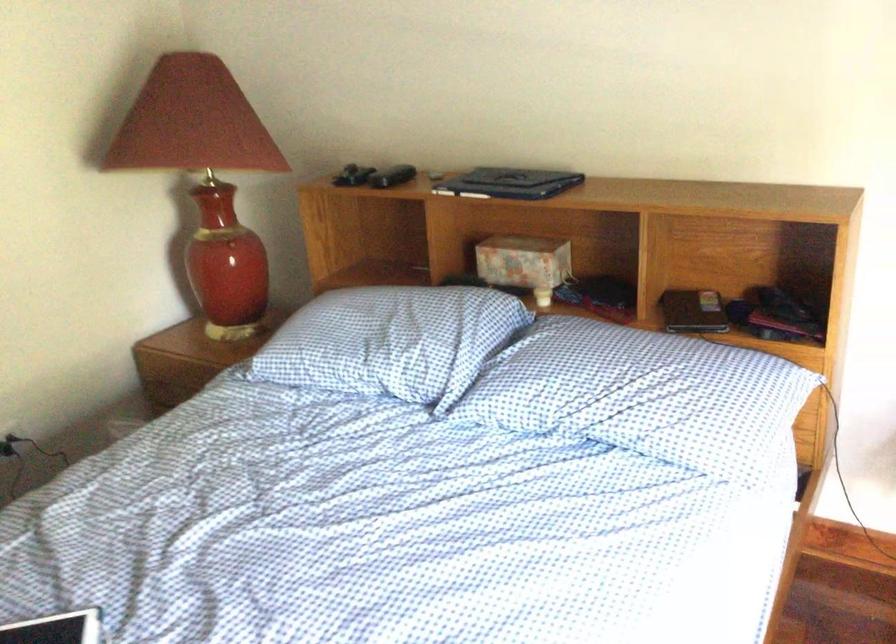
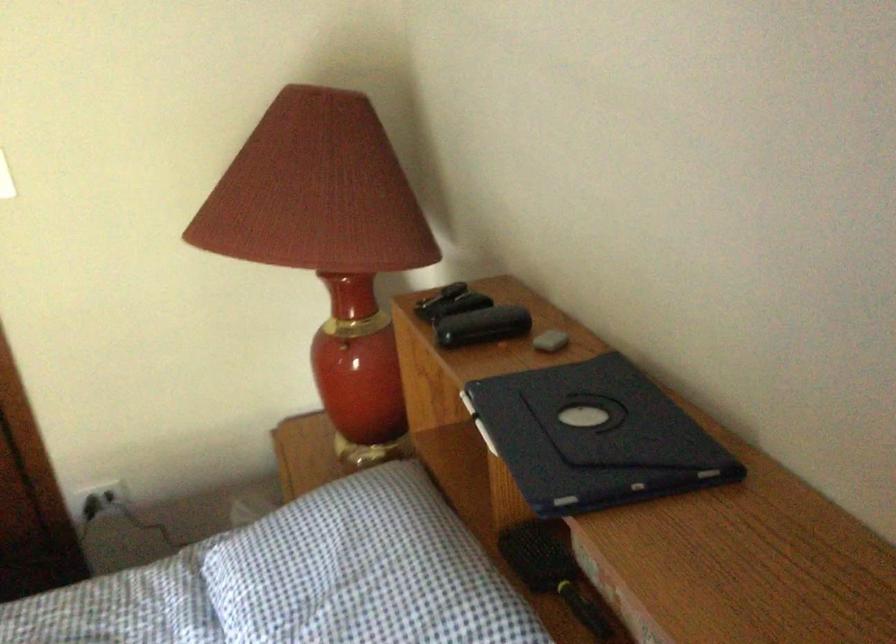
Locate, in the second image, the point that corresponds to the point at 521,180 in the first image.

(593, 437)